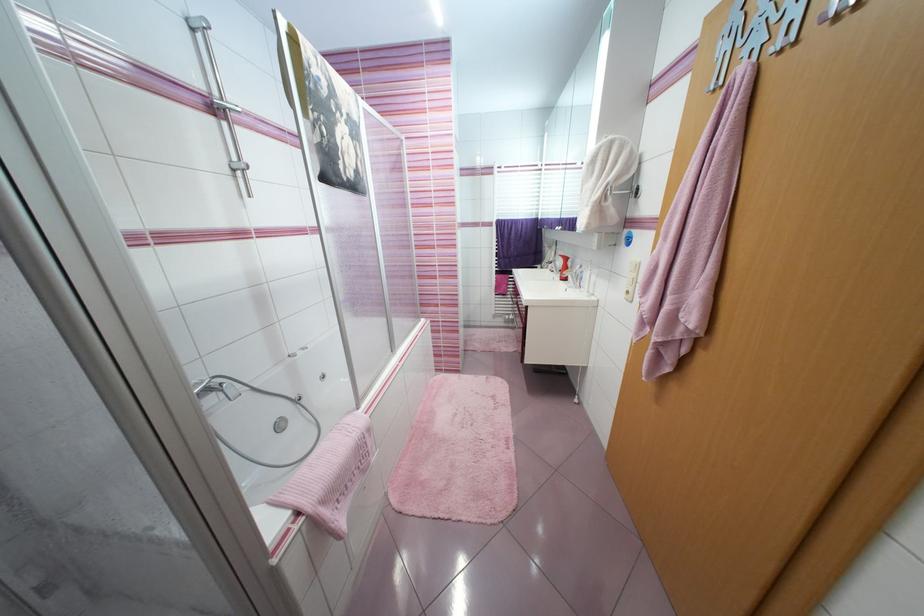
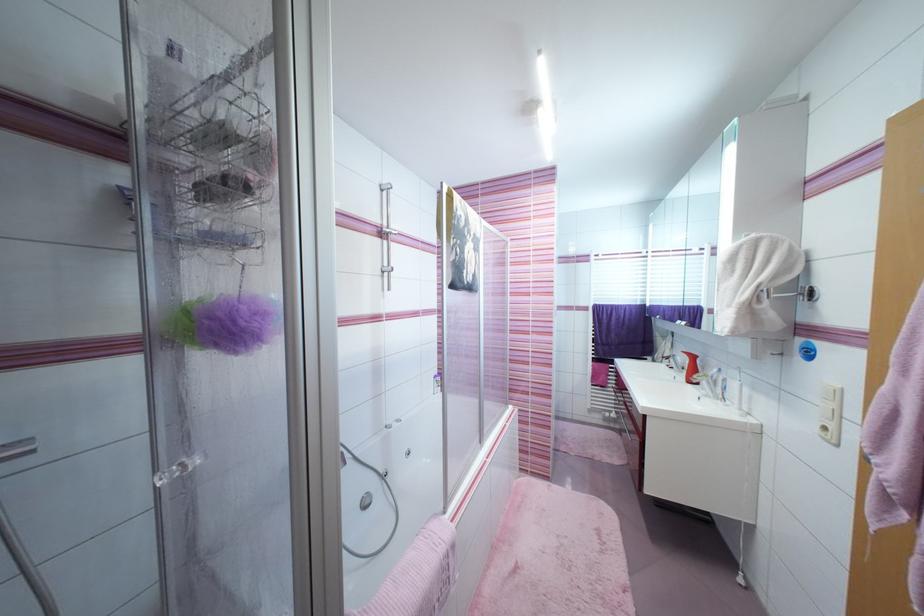
Locate, in the second image, the point that corresponds to pixel 198 31 in the first image.

(387, 192)